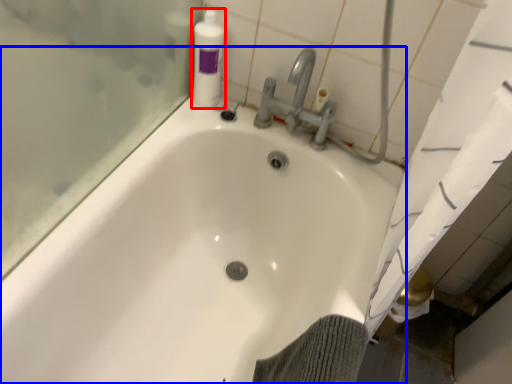
Question: Among these objects, which one is nearest to the camera, cleaning product (highlighted by a red box) or bathtub (highlighted by a blue box)?

Choices:
 (A) cleaning product
 (B) bathtub

Answer: (B)